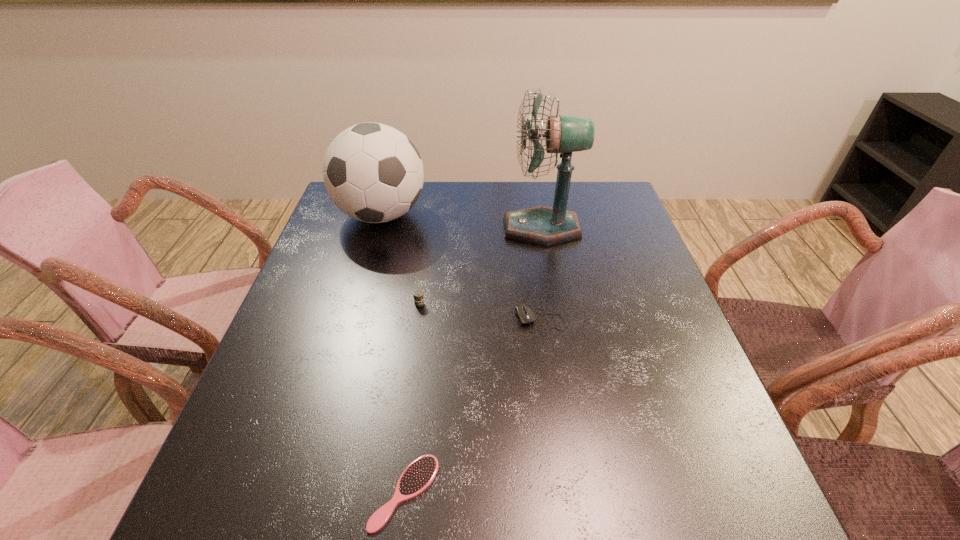
Where is `vacant region located 0.140m on the left of the beer can`? The width and height of the screenshot is (960, 540). vacant region located 0.140m on the left of the beer can is located at coordinates (344, 304).

Find the location of a particular element. This screenshot has width=960, height=540. free space located 0.350m on the left of the computer mouse is located at coordinates click(x=358, y=321).

At what (x,y) coordinates should I click in order to perform the action: click on vacant space positioned 0.300m on the back of the nearest object. Please return your answer as a coordinate pair (x, y). Image resolution: width=960 pixels, height=540 pixels. Looking at the image, I should click on (425, 325).

The height and width of the screenshot is (540, 960). What are the coordinates of `fan that is at the far edge` in the screenshot? It's located at (541, 225).

This screenshot has width=960, height=540. I want to click on soccer ball located in the far edge section of the desktop, so click(372, 172).

Find the location of `object that is at the near edge`. object that is at the near edge is located at coordinates (419, 474).

You are a GUI agent. You are given a task and a screenshot of the screen. Output one action in this format:
    pyautogui.click(x=<x>, y=<y>)
    Task: Click on the object present at the left edge
    
    Given the screenshot: What is the action you would take?
    pyautogui.click(x=372, y=172)

The image size is (960, 540). Identify the location of object that is at the right edge. (541, 225).

I want to click on object present at the far left corner, so click(372, 172).

Find the location of a particular element. This screenshot has height=540, width=960. object at the far right corner is located at coordinates (541, 225).